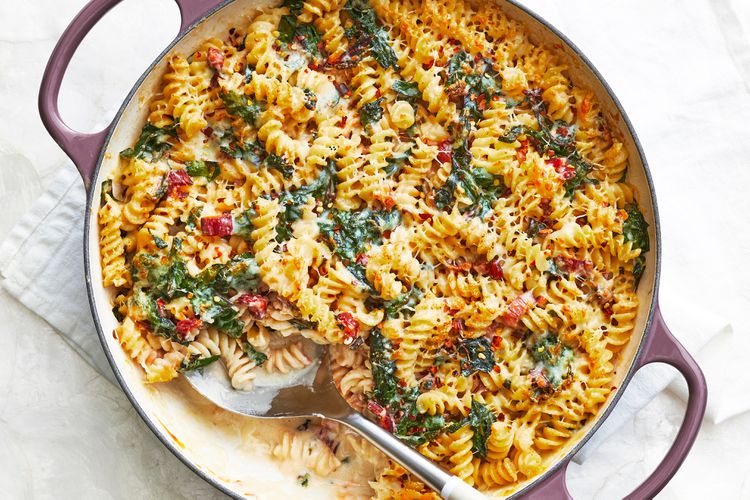
Where is `spoon`? This screenshot has width=750, height=500. spoon is located at coordinates (304, 400).